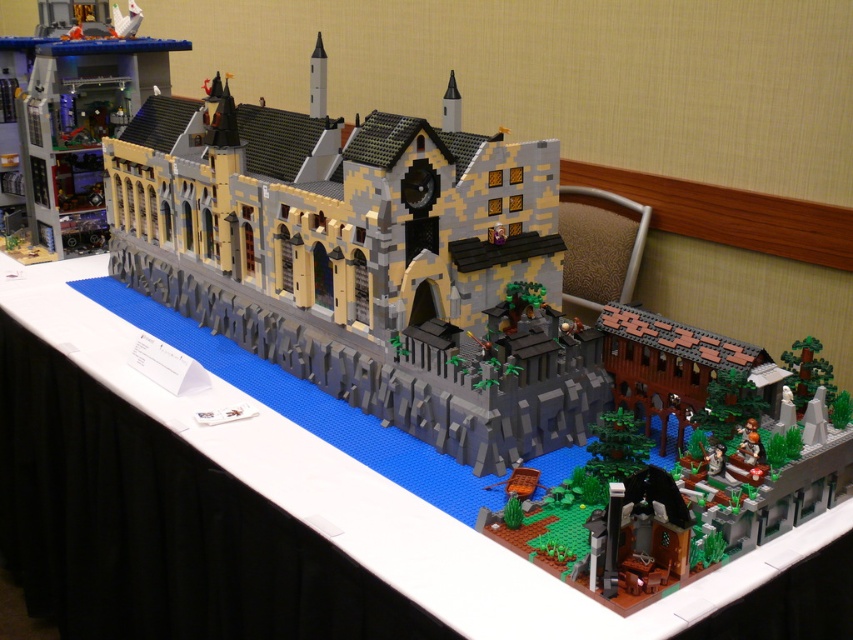
You are setting up a display for a LEGO exhibition. You have a white matte table at center and a smooth plastic castle at upper left. The castle needs to be placed on the table. Can the castle fit on the table without overhanging the edges?

The white matte table at center is wider than the smooth plastic castle at upper left, so the castle can fit on the table without overhanging the edges.

You are a visitor at a LEGO exhibition and see the smooth plastic castle at upper left and the brown textured building at lower right. Which one is located to the left side of the other?

The smooth plastic castle at upper left is positioned on the left side of brown textured building at lower right.